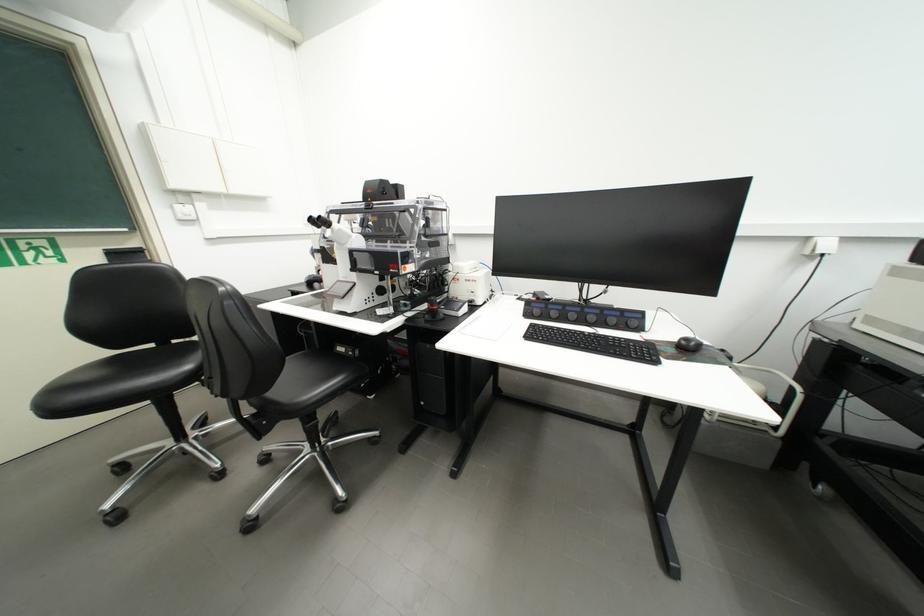
Find where to turn the black control knob. Please return your answer as a coordinate pair (x, y).

(688, 344)